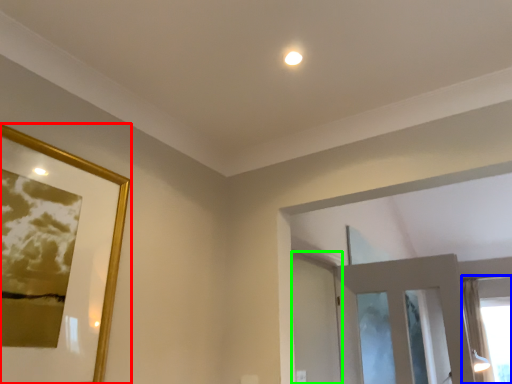
Question: Which object is positioned farthest from picture frame (highlighted by a red box)? Select from window (highlighted by a blue box) and screen door (highlighted by a green box).

Choices:
 (A) window
 (B) screen door

Answer: (A)